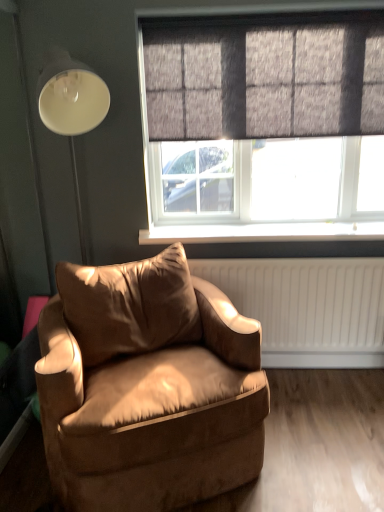
Question: Does dark grey textured curtain at upper center turn towards white plastic window sill at center?

Choices:
 (A) no
 (B) yes

Answer: (A)

Question: Is dark grey textured curtain at upper center in contact with white plastic window sill at center?

Choices:
 (A) yes
 (B) no

Answer: (B)

Question: Are dark grey textured curtain at upper center and white plastic window sill at center far apart?

Choices:
 (A) yes
 (B) no

Answer: (B)

Question: Does dark grey textured curtain at upper center have a lesser width compared to white plastic window sill at center?

Choices:
 (A) no
 (B) yes

Answer: (B)

Question: Is white plastic window sill at center completely or partially inside dark grey textured curtain at upper center?

Choices:
 (A) yes
 (B) no

Answer: (B)

Question: Does dark grey textured curtain at upper center have a smaller size compared to white plastic window sill at center?

Choices:
 (A) no
 (B) yes

Answer: (A)

Question: Could you tell me if suede-like brown armchair at lower left is facing textured gray window at upper center?

Choices:
 (A) no
 (B) yes

Answer: (A)

Question: From a real-world perspective, is suede-like brown armchair at lower left physically below textured gray window at upper center?

Choices:
 (A) yes
 (B) no

Answer: (A)

Question: Does suede-like brown armchair at lower left appear on the right side of textured gray window at upper center?

Choices:
 (A) yes
 (B) no

Answer: (B)

Question: Does suede-like brown armchair at lower left lie in front of textured gray window at upper center?

Choices:
 (A) no
 (B) yes

Answer: (B)

Question: From the image's perspective, would you say suede-like brown armchair at lower left is shown under textured gray window at upper center?

Choices:
 (A) yes
 (B) no

Answer: (A)

Question: Considering the relative sizes of suede-like brown armchair at lower left and textured gray window at upper center in the image provided, is suede-like brown armchair at lower left wider than textured gray window at upper center?

Choices:
 (A) yes
 (B) no

Answer: (A)

Question: Can you confirm if textured gray window at upper center is smaller than dark grey textured curtain at upper center?

Choices:
 (A) yes
 (B) no

Answer: (B)